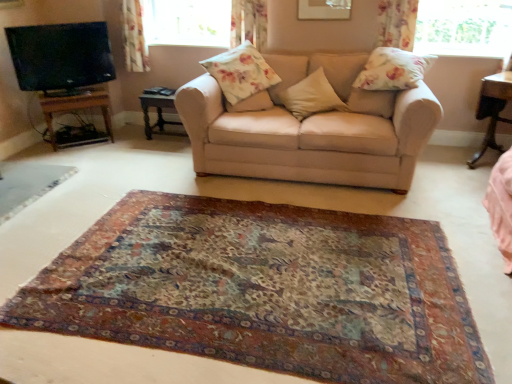
What do you see at coordinates (134, 37) in the screenshot? I see `floral fabric curtain at upper left, placed as the third curtain when sorted from right to left` at bounding box center [134, 37].

The width and height of the screenshot is (512, 384). Describe the element at coordinates (187, 22) in the screenshot. I see `transparent glass window at upper center, the 1th window positioned from the left` at that location.

In order to face wooden table at left, the 1th table positioned from the left, should I rotate leftwards or rightwards?

To align with it, rotate left about 22.817°.

The image size is (512, 384). What do you see at coordinates (241, 72) in the screenshot?
I see `floral fabric pillow at center, which is counted as the fourth pillow, starting from the right` at bounding box center [241, 72].

What is the approximate width of transparent glass window at upper right, placed as the first window when sorted from front to back?

It is 3.60 inches.

I want to click on floral fabric pillow at upper right, the 4th pillow positioned from the left, so click(x=393, y=70).

Between beige fabric couch at center and fluffy beige pillow at center, which ranks as the 2th pillow in right-to-left order, which one is positioned behind?

fluffy beige pillow at center, which ranks as the 2th pillow in right-to-left order.

From a real-world perspective, is beige fabric couch at center above or below fluffy beige pillow at center, which ranks as the 2th pillow in right-to-left order?

In terms of real-world spatial position, beige fabric couch at center is below fluffy beige pillow at center, which ranks as the 2th pillow in right-to-left order.

Visually, is beige fabric couch at center positioned to the left or to the right of fluffy beige pillow at center, placed as the 3th pillow when sorted from left to right?

beige fabric couch at center is positioned on fluffy beige pillow at center, placed as the 3th pillow when sorted from left to right,'s left side.

Measure the distance from beige fabric couch at center to fluffy beige pillow at center, placed as the 3th pillow when sorted from left to right.

beige fabric couch at center and fluffy beige pillow at center, placed as the 3th pillow when sorted from left to right, are 33.49 centimeters apart from each other.

From a real-world perspective, is wooden table at left, acting as the 2th table starting from the left, positioned over floral fabric curtain at upper left, the 1th curtain in the left-to-right sequence, based on gravity?

Incorrect, from a real-world perspective, wooden table at left, acting as the 2th table starting from the left, is lower than floral fabric curtain at upper left, the 1th curtain in the left-to-right sequence.

Who is smaller, wooden table at left, which is counted as the second table, starting from the right, or floral fabric curtain at upper left, placed as the third curtain when sorted from right to left?

With smaller size is floral fabric curtain at upper left, placed as the third curtain when sorted from right to left.

Could you tell me if wooden table at left, acting as the 2th table starting from the left, is turned towards floral fabric curtain at upper left, placed as the third curtain when sorted from right to left?

No, wooden table at left, acting as the 2th table starting from the left, is not oriented towards floral fabric curtain at upper left, placed as the third curtain when sorted from right to left.

Is fluffy beige pillow at center, which ranks as the 2th pillow in right-to-left order, wider or thinner than floral fabric pillow at center, which is counted as the fourth pillow, starting from the right?

In the image, fluffy beige pillow at center, which ranks as the 2th pillow in right-to-left order, appears to be more narrow than floral fabric pillow at center, which is counted as the fourth pillow, starting from the right.

Is fluffy beige pillow at center, which ranks as the 2th pillow in right-to-left order, turned away from floral fabric pillow at center, which is counted as the fourth pillow, starting from the right?

No, fluffy beige pillow at center, which ranks as the 2th pillow in right-to-left order, is not facing the opposite direction of floral fabric pillow at center, which is counted as the fourth pillow, starting from the right.

From the image's perspective, which is above, fluffy beige pillow at center, which ranks as the 2th pillow in right-to-left order, or floral fabric pillow at center, which is counted as the fourth pillow, starting from the right?

floral fabric pillow at center, which is counted as the fourth pillow, starting from the right, appears higher in the image.

Is fluffy beige pillow at center, placed as the 3th pillow when sorted from left to right, outside of floral fabric pillow at center, which is counted as the fourth pillow, starting from the right?

fluffy beige pillow at center, placed as the 3th pillow when sorted from left to right, lies outside floral fabric pillow at center, which is counted as the fourth pillow, starting from the right,'s area.

Is wooden table at left, which is counted as the second table, starting from the right, oriented towards fluffy beige pillow at center, which ranks as the 2th pillow in right-to-left order?

No, wooden table at left, which is counted as the second table, starting from the right, is not oriented towards fluffy beige pillow at center, which ranks as the 2th pillow in right-to-left order.

Which is behind, wooden table at left, which is counted as the second table, starting from the right, or fluffy beige pillow at center, placed as the 3th pillow when sorted from left to right?

wooden table at left, which is counted as the second table, starting from the right.

Is there a large distance between wooden table at left, which is counted as the second table, starting from the right, and fluffy beige pillow at center, which ranks as the 2th pillow in right-to-left order?

That's right, there is a large distance between wooden table at left, which is counted as the second table, starting from the right, and fluffy beige pillow at center, which ranks as the 2th pillow in right-to-left order.

Where is `the 3rd pillow in front of the wooden table at left, acting as the 2th table starting from the left, starting your count from the anchor`? the 3rd pillow in front of the wooden table at left, acting as the 2th table starting from the left, starting your count from the anchor is located at coordinates (311, 96).

How many degrees apart are the facing directions of wooden table at left, the 1th table positioned from the left, and carpeted mat at center?

There is a 37.6-degree angle between the facing directions of wooden table at left, the 1th table positioned from the left, and carpeted mat at center.

From the image's perspective, which one is positioned lower, wooden table at left, the 1th table positioned from the left, or carpeted mat at center?

carpeted mat at center, from the image's perspective.

Is wooden table at left, the third table in the right-to-left sequence, positioned far away from carpeted mat at center?

Indeed, wooden table at left, the third table in the right-to-left sequence, is not near carpeted mat at center.

From the image's perspective, is wooden table at right, the third table when ordered from left to right, over transparent glass window at upper center, acting as the first window starting from the back?

No, from the image's perspective, wooden table at right, the third table when ordered from left to right, is not over transparent glass window at upper center, acting as the first window starting from the back.

Visually, is wooden table at right, the first table positioned from the right, positioned to the left or to the right of transparent glass window at upper center, which is counted as the 2th window, starting from the front?

Based on their positions, wooden table at right, the first table positioned from the right, is located to the right of transparent glass window at upper center, which is counted as the 2th window, starting from the front.

Would you say wooden table at right, the third table when ordered from left to right, is a long distance from transparent glass window at upper center, which is counted as the 2th window, starting from the front?

Absolutely, wooden table at right, the third table when ordered from left to right, is distant from transparent glass window at upper center, which is counted as the 2th window, starting from the front.

Is wooden table at right, the first table positioned from the right, positioned before transparent glass window at upper center, which is counted as the 2th window, starting from the front?

Yes, the depth of wooden table at right, the first table positioned from the right, is less than that of transparent glass window at upper center, which is counted as the 2th window, starting from the front.

Based on the photo, how far apart are carpeted mat at center and floral fabric curtain at upper left, placed as the third curtain when sorted from right to left?

carpeted mat at center and floral fabric curtain at upper left, placed as the third curtain when sorted from right to left, are 8.94 feet apart.

From the image's perspective, does carpeted mat at center appear higher than floral fabric curtain at upper left, the 1th curtain in the left-to-right sequence?

Incorrect, from the image's perspective, carpeted mat at center is lower than floral fabric curtain at upper left, the 1th curtain in the left-to-right sequence.

Is carpeted mat at center not close to floral fabric curtain at upper left, placed as the third curtain when sorted from right to left?

carpeted mat at center is positioned a significant distance from floral fabric curtain at upper left, placed as the third curtain when sorted from right to left.

From the carpeted mat at center, count the 2nd curtain to the left and point to it. Please provide its 2D coordinates.

[(134, 37)]

Identify the location of studio couch located on the left of fluffy beige pillow at center, placed as the 3th pillow when sorted from left to right. (312, 129).

The image size is (512, 384). I want to click on the 1st table below the floral fabric curtain at upper left, the 1th curtain in the left-to-right sequence (from the image's perspective), so click(157, 113).

Consider the image. Considering their positions, is floral fabric curtain at upper center, which is the 2th curtain in left-to-right order, positioned further to floral fabric pillow at upper right, placed as the 1th pillow when sorted from right to left, than wooden table at left, which is counted as the second table, starting from the right?

wooden table at left, which is counted as the second table, starting from the right.

From the image, which object appears to be nearer to floral fabric curtain at upper left, the 1th curtain in the left-to-right sequence, transparent glass window at upper right, the 2th window viewed from the left, or fluffy beige pillow at center, which ranks as the 2th pillow in right-to-left order?

fluffy beige pillow at center, which ranks as the 2th pillow in right-to-left order, lies closer to floral fabric curtain at upper left, the 1th curtain in the left-to-right sequence, than the other object.

When comparing their distances from floral fabric curtain at upper left, placed as the third curtain when sorted from right to left, does floral fabric curtain at upper center, which is the 2th curtain in left-to-right order, or flat screen tv at left seem further?

Among the two, floral fabric curtain at upper center, which is the 2th curtain in left-to-right order, is located further to floral fabric curtain at upper left, placed as the third curtain when sorted from right to left.

From the image, which object appears to be nearer to carpeted mat at center, flat screen tv at left or floral fabric pillow at upper right, the 4th pillow positioned from the left?

Among the two, floral fabric pillow at upper right, the 4th pillow positioned from the left, is located nearer to carpeted mat at center.

Which object lies further to the anchor point floral fabric pillow at center, which is counted as the fourth pillow, starting from the right, wooden table at left, acting as the 2th table starting from the left, or floral fabric pillow at center, positioned as the 2th pillow in left-to-right order?

wooden table at left, acting as the 2th table starting from the left, lies further to floral fabric pillow at center, which is counted as the fourth pillow, starting from the right, than the other object.

When comparing their distances from wooden table at left, the 1th table positioned from the left, does transparent glass window at upper right, which is the 1th window in right-to-left order, or floral fabric curtain at upper center, the 2th curtain viewed from the right, seem further?

transparent glass window at upper right, which is the 1th window in right-to-left order, is positioned further to the anchor wooden table at left, the 1th table positioned from the left.

Based on their spatial positions, is wooden table at left, which is counted as the second table, starting from the right, or flat screen tv at left closer to beige fabric couch at center?

Based on the image, wooden table at left, which is counted as the second table, starting from the right, appears to be nearer to beige fabric couch at center.

Considering their positions, is fluffy beige pillow at center, placed as the 3th pillow when sorted from left to right, positioned further to wooden table at left, which is counted as the second table, starting from the right, than floral fabric curtain at upper center, which is the 2th curtain in left-to-right order?

Based on the image, fluffy beige pillow at center, placed as the 3th pillow when sorted from left to right, appears to be further to wooden table at left, which is counted as the second table, starting from the right.

Where is `curtain situated between flat screen tv at left and floral fabric pillow at center, which is counted as the fourth pillow, starting from the right, from left to right`? curtain situated between flat screen tv at left and floral fabric pillow at center, which is counted as the fourth pillow, starting from the right, from left to right is located at coordinates (134, 37).

Find the location of a particular element. studio couch situated between floral fabric pillow at center, which ranks as the 3th pillow in right-to-left order, and wooden table at right, the first table positioned from the right, from left to right is located at coordinates (312, 129).

Locate an element on the screen. Image resolution: width=512 pixels, height=384 pixels. studio couch between carpeted mat at center and transparent glass window at upper center, the 1th window positioned from the left, from front to back is located at coordinates (312, 129).

Where is `television positioned between carpeted mat at center and wooden table at left, which is counted as the second table, starting from the right, from near to far`? The height and width of the screenshot is (384, 512). television positioned between carpeted mat at center and wooden table at left, which is counted as the second table, starting from the right, from near to far is located at coordinates (60, 55).